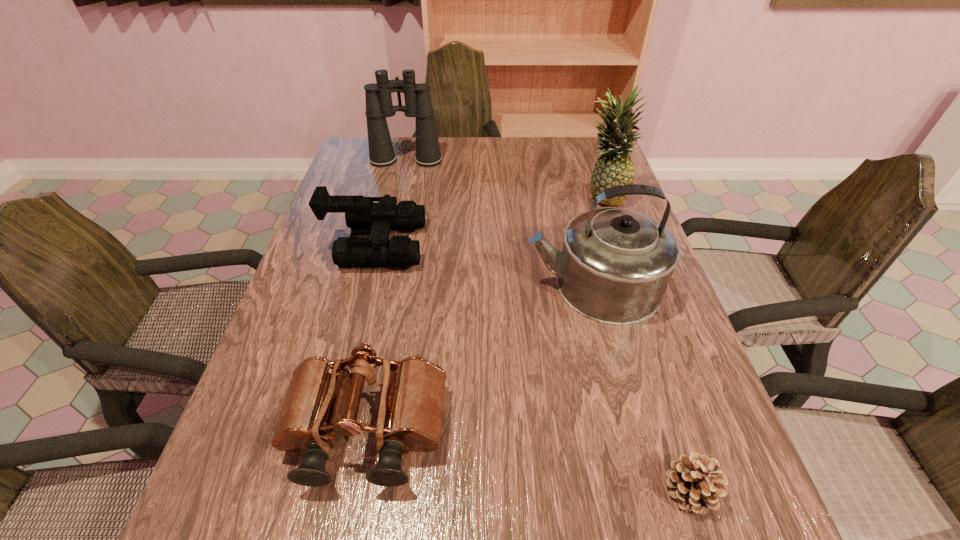
Identify the location of the fifth nearest object. (614, 167).

Locate an element on the screen. This screenshot has width=960, height=540. the farthest binoculars is located at coordinates (418, 104).

You are a GUI agent. You are given a task and a screenshot of the screen. Output one action in this format:
    pyautogui.click(x=<x>, y=<y>)
    Task: Click on the farthest object
    
    Given the screenshot: What is the action you would take?
    pyautogui.click(x=418, y=104)

You are a GUI agent. You are given a task and a screenshot of the screen. Output one action in this format:
    pyautogui.click(x=<x>, y=<y>)
    Task: Click on the kettle
    
    Given the screenshot: What is the action you would take?
    pyautogui.click(x=616, y=263)

Where is `the second farthest binoculars`? The width and height of the screenshot is (960, 540). the second farthest binoculars is located at coordinates (400, 252).

Locate an element on the screen. the nearest binoculars is located at coordinates (410, 414).

Locate an element on the screen. This screenshot has width=960, height=540. the shortest object is located at coordinates (694, 481).

Where is `vacant space positioned on the left of the pineapple`? This screenshot has height=540, width=960. vacant space positioned on the left of the pineapple is located at coordinates (481, 197).

Image resolution: width=960 pixels, height=540 pixels. I want to click on vacant space located on the front of the tallest binoculars, so pyautogui.click(x=395, y=210).

This screenshot has height=540, width=960. Find the location of `free space located 0.180m with the spout at the front of the kettle`. free space located 0.180m with the spout at the front of the kettle is located at coordinates (446, 285).